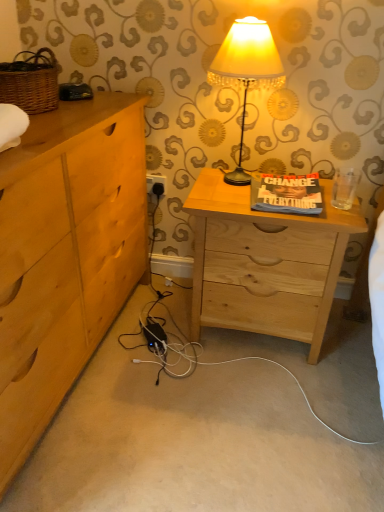
Locate an element on the screen. The image size is (384, 512). vacant space situated above natural wood nightstand at center (from a real-world perspective) is located at coordinates click(266, 199).